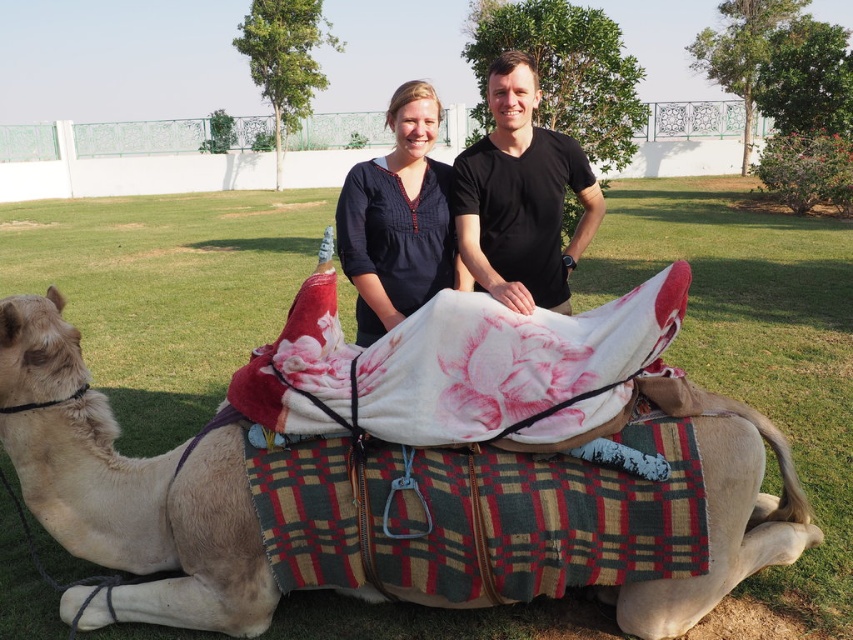
Question: Which point is closer to the camera taking this photo?

Choices:
 (A) (506, 145)
 (B) (84, 408)

Answer: (B)

Question: Can you confirm if beige woolen camel at center is positioned to the left of dark blue cotton shirt at center?

Choices:
 (A) no
 (B) yes

Answer: (B)

Question: Is beige woolen camel at center below floral-patterned fleece blanket at center?

Choices:
 (A) yes
 (B) no

Answer: (A)

Question: Which point is closer to the camera?

Choices:
 (A) black matte shirt at center
 (B) beige woolen camel at center

Answer: (B)

Question: Among these objects, which one is farthest from the camera?

Choices:
 (A) dark blue cotton shirt at center
 (B) black matte shirt at center
 (C) beige woolen camel at center

Answer: (A)

Question: Observing the image, what is the correct spatial positioning of beige woolen camel at center in reference to black matte shirt at center?

Choices:
 (A) right
 (B) left

Answer: (B)